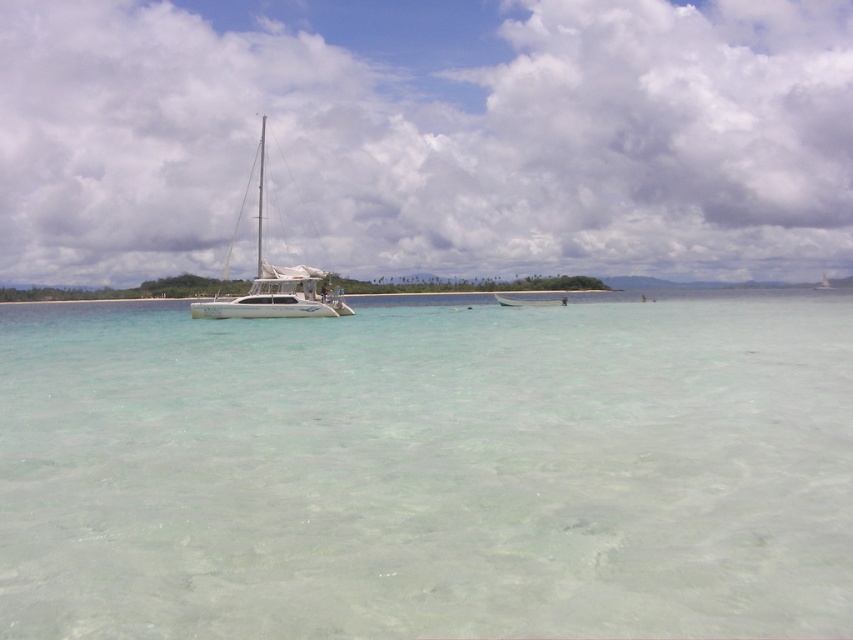
Based on the photo, you are a snorkeler who wants to swim to the white glossy sailboat at center. From your current position in the clear water at center, which direction should you swim to reach the boat?

The clear water at center is in front of the white glossy sailboat at center, so you should swim backward to reach the boat.

You are standing on the shore looking out at the tropical seascape. You see the clear water at center and the green plastic boat at center. Which object is closer to you?

The clear water at center is closer to the viewer than the green plastic boat at center.